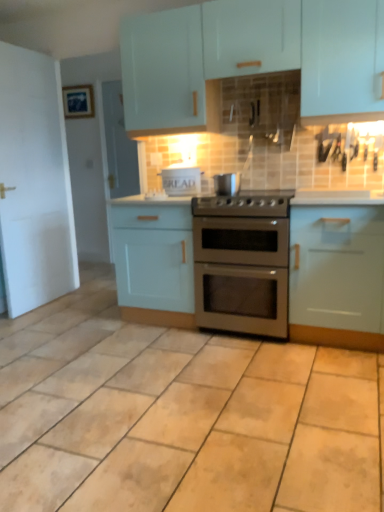
Question: Looking at their shapes, would you say matte light blue cabinet at center, the 2th cabinetry viewed from the top, is wider or thinner than matte white cabinets at upper center, placed as the third cabinetry when sorted from bottom to top?

Choices:
 (A) thin
 (B) wide

Answer: (B)

Question: From the image's perspective, relative to matte white cabinets at upper center, placed as the 1th cabinetry when sorted from top to bottom, is matte light blue cabinet at center, the 2th cabinetry viewed from the top, above or below?

Choices:
 (A) above
 (B) below

Answer: (B)

Question: Estimate the real-world distances between objects in this image. Which object is closer to the matte white cabinets at upper center, placed as the 1th cabinetry when sorted from top to bottom?

Choices:
 (A) light blue matte cabinet at lower right, positioned as the third cabinetry in top-to-bottom order
 (B) matte light blue cabinet at center, which is the second cabinetry in bottom-to-top order
 (C) satin silver pot at center, the 2th appliance when ordered from left to right
 (D) stainless steel gas stove at center
 (E) white cardboard bread box at center, which appears as the first appliance when viewed from the left

Answer: (E)

Question: Considering the real-world distances, which object is farthest from the white glossy countertop at center?

Choices:
 (A) satin silver oven at center
 (B) matte white cabinets at upper center, placed as the third cabinetry when sorted from bottom to top
 (C) light blue matte cabinet at lower right, positioned as the third cabinetry in top-to-bottom order
 (D) stainless steel gas stove at center
 (E) matte blue picture frame at upper left

Answer: (E)